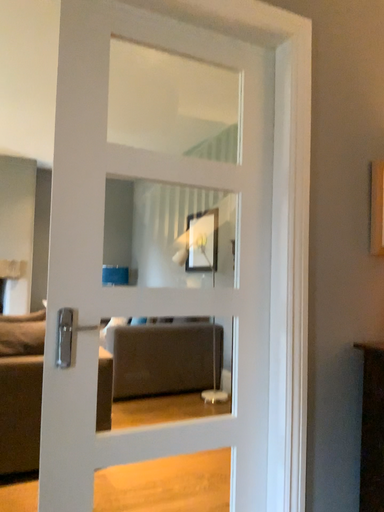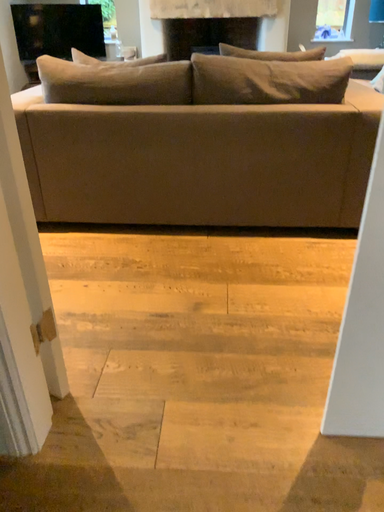
Question: Which way did the camera rotate in the video?

Choices:
 (A) rotated downward
 (B) rotated upward

Answer: (A)